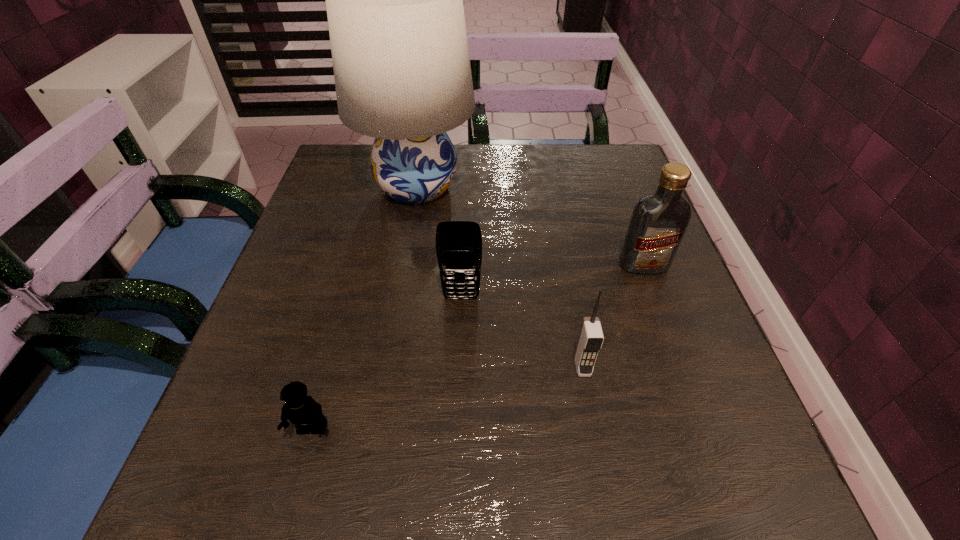
The width and height of the screenshot is (960, 540). Identify the location of free space between the vodka and the farther cellular telephone. coord(552,281).

The width and height of the screenshot is (960, 540). I want to click on free area in between the shortest object and the nearer cellular telephone, so click(447, 397).

This screenshot has height=540, width=960. I want to click on free point between the right cellular telephone and the vodka, so click(x=612, y=315).

The image size is (960, 540). Identify the location of unoccupied position between the nearest object and the tallest object. (365, 308).

This screenshot has height=540, width=960. What are the coordinates of `free space that is in between the lampshade and the Lego` in the screenshot? It's located at (365, 308).

The height and width of the screenshot is (540, 960). Identify the location of object that is the second closest to the second object from right to left. (659, 220).

What are the coordinates of `object that is the fourth closest to the tallest object` in the screenshot? It's located at (303, 411).